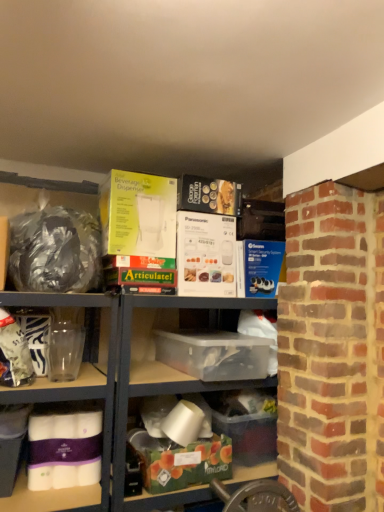
Question: Are translucent plastic container at center, the 1th box ordered from the bottom, and yellow cardboard beverage dispenser at upper center, the 5th box ordered from the bottom, far apart?

Choices:
 (A) no
 (B) yes

Answer: (A)

Question: Is translucent plastic container at center, the 1th box ordered from the bottom, positioned behind yellow cardboard beverage dispenser at upper center, which ranks as the first box in top-to-bottom order?

Choices:
 (A) yes
 (B) no

Answer: (A)

Question: Does translucent plastic container at center, arranged as the fifth box when viewed from the top, lie in front of yellow cardboard beverage dispenser at upper center, the 5th box ordered from the bottom?

Choices:
 (A) yes
 (B) no

Answer: (B)

Question: Can you confirm if translucent plastic container at center, the 1th box ordered from the bottom, is bigger than yellow cardboard beverage dispenser at upper center, which ranks as the first box in top-to-bottom order?

Choices:
 (A) no
 (B) yes

Answer: (A)

Question: From the image's perspective, would you say translucent plastic container at center, arranged as the fifth box when viewed from the top, is shown under yellow cardboard beverage dispenser at upper center, the 5th box ordered from the bottom?

Choices:
 (A) no
 (B) yes

Answer: (B)

Question: Considering the positions of clear plastic container at center and transparent plastic box at center, the fourth box from the bottom, in the image, is clear plastic container at center taller or shorter than transparent plastic box at center, the fourth box from the bottom,?

Choices:
 (A) tall
 (B) short

Answer: (A)

Question: Considering the positions of point (127, 337) and point (188, 335), is point (127, 337) closer or farther from the camera than point (188, 335)?

Choices:
 (A) farther
 (B) closer

Answer: (B)

Question: Is clear plastic container at center bigger or smaller than transparent plastic box at center, marked as the 2th box in a top-to-bottom arrangement?

Choices:
 (A) big
 (B) small

Answer: (A)

Question: From the image's perspective, relative to transparent plastic box at center, the fourth box from the bottom, is clear plastic container at center above or below?

Choices:
 (A) below
 (B) above

Answer: (A)

Question: Considering the relative positions of yellow cardboard beverage dispenser at upper center, the 5th box ordered from the bottom, and green matte box at lower center, the fourth box positioned from the top, in the image provided, is yellow cardboard beverage dispenser at upper center, the 5th box ordered from the bottom, to the left or to the right of green matte box at lower center, the fourth box positioned from the top,?

Choices:
 (A) left
 (B) right

Answer: (A)

Question: From their relative heights in the image, would you say yellow cardboard beverage dispenser at upper center, the 5th box ordered from the bottom, is taller or shorter than green matte box at lower center, which is the second box in bottom-to-top order?

Choices:
 (A) short
 (B) tall

Answer: (B)

Question: Considering the positions of yellow cardboard beverage dispenser at upper center, the 5th box ordered from the bottom, and green matte box at lower center, the fourth box positioned from the top, in the image, is yellow cardboard beverage dispenser at upper center, the 5th box ordered from the bottom, bigger or smaller than green matte box at lower center, the fourth box positioned from the top,?

Choices:
 (A) big
 (B) small

Answer: (A)

Question: From a real-world perspective, is yellow cardboard beverage dispenser at upper center, the 5th box ordered from the bottom, physically located above or below green matte box at lower center, which is the second box in bottom-to-top order?

Choices:
 (A) above
 (B) below

Answer: (A)

Question: In the image, is transparent plastic box at center, the fourth box from the bottom, positioned in front of or behind yellow cardboard beverage dispenser at upper center, the 5th box ordered from the bottom?

Choices:
 (A) front
 (B) behind

Answer: (A)

Question: Based on their sizes in the image, would you say transparent plastic box at center, the fourth box from the bottom, is bigger or smaller than yellow cardboard beverage dispenser at upper center, the 5th box ordered from the bottom?

Choices:
 (A) small
 (B) big

Answer: (B)